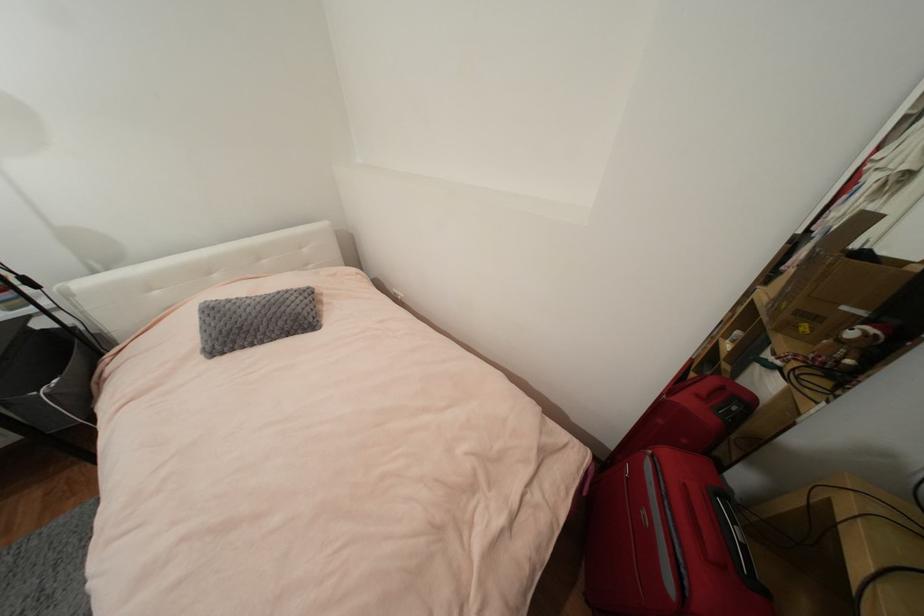
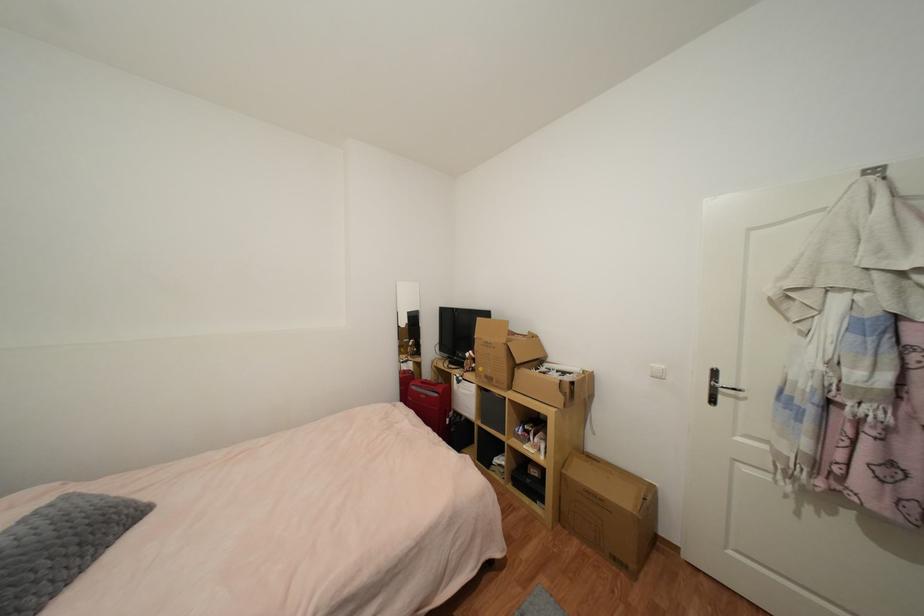
Locate, in the second image, the point that corresponds to [675,588] in the first image.

(440, 397)